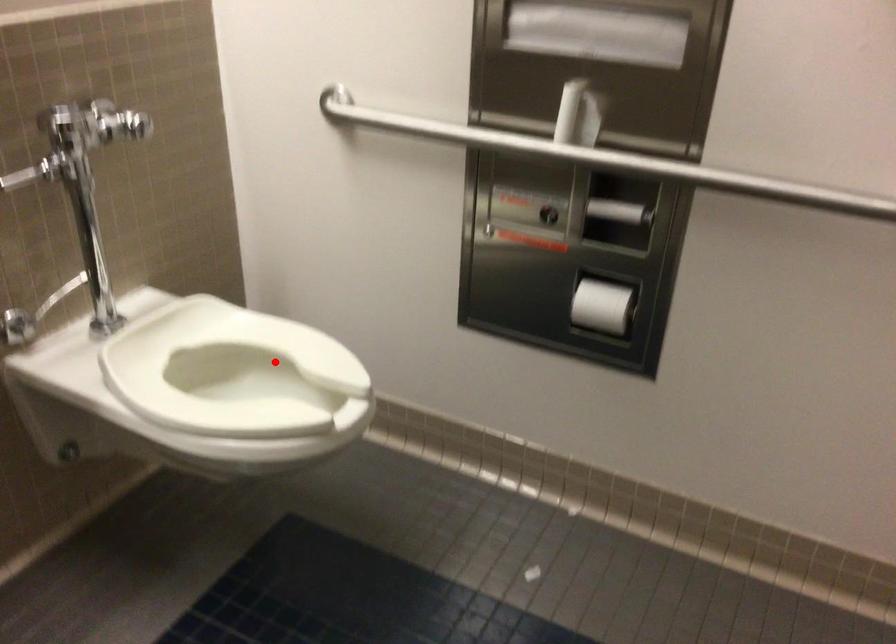
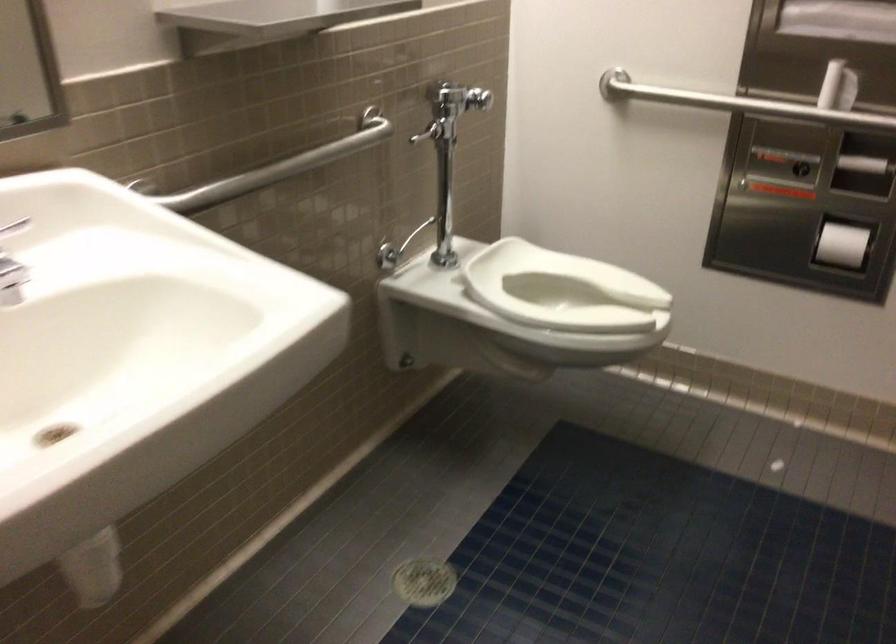
Find the pixel in the second image that matches the highlighted location in the first image.

(563, 290)